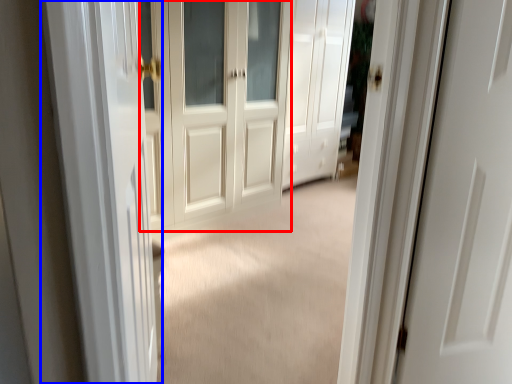
Question: Which of the following is the farthest to the observer, door (highlighted by a red box) or screen door (highlighted by a blue box)?

Choices:
 (A) door
 (B) screen door

Answer: (A)